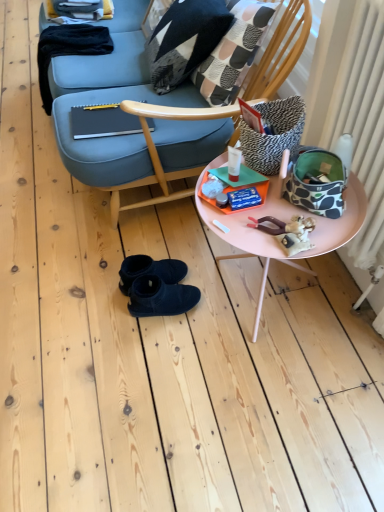
Question: Can you confirm if zebra-patterned fabric pillow at upper right, the 1th pillow in the front-to-back sequence, is wider than patchwork fabric throw pillow at upper center?

Choices:
 (A) no
 (B) yes

Answer: (A)

Question: Is zebra-patterned fabric pillow at upper right, arranged as the second pillow when viewed from the top, positioned with its back to patchwork fabric throw pillow at upper center?

Choices:
 (A) no
 (B) yes

Answer: (A)

Question: From a real-world perspective, is zebra-patterned fabric pillow at upper right, the 1th pillow positioned from the bottom, below patchwork fabric throw pillow at upper center?

Choices:
 (A) no
 (B) yes

Answer: (A)

Question: Is zebra-patterned fabric pillow at upper right, arranged as the second pillow when viewed from the top, positioned behind patchwork fabric throw pillow at upper center?

Choices:
 (A) no
 (B) yes

Answer: (A)

Question: Does zebra-patterned fabric pillow at upper right, positioned as the 1th pillow in right-to-left order, have a lesser height compared to patchwork fabric throw pillow at upper center?

Choices:
 (A) yes
 (B) no

Answer: (A)

Question: Based on their sizes in the image, would you say zebra-patterned fabric pillow at upper right, positioned as the 1th pillow in right-to-left order, is bigger or smaller than black suede boots at center?

Choices:
 (A) big
 (B) small

Answer: (A)

Question: Considering the positions of zebra-patterned fabric pillow at upper right, positioned as the 1th pillow in right-to-left order, and black suede boots at center in the image, is zebra-patterned fabric pillow at upper right, positioned as the 1th pillow in right-to-left order, wider or thinner than black suede boots at center?

Choices:
 (A) thin
 (B) wide

Answer: (A)

Question: Is zebra-patterned fabric pillow at upper right, marked as the second pillow in a back-to-front arrangement, in front of or behind black suede boots at center in the image?

Choices:
 (A) behind
 (B) front

Answer: (B)

Question: Is zebra-patterned fabric pillow at upper right, positioned as the second pillow in left-to-right order, taller or shorter than black suede boots at center?

Choices:
 (A) short
 (B) tall

Answer: (B)

Question: Which is correct: pink plastic table at center is inside black-and-white geometric-patterned pillow at upper center, positioned as the 2th pillow in bottom-to-top order, or outside of it?

Choices:
 (A) inside
 (B) outside

Answer: (B)

Question: Considering the positions of pink plastic table at center and black-and-white geometric-patterned pillow at upper center, the 2th pillow viewed from the right, in the image, is pink plastic table at center bigger or smaller than black-and-white geometric-patterned pillow at upper center, the 2th pillow viewed from the right,?

Choices:
 (A) small
 (B) big

Answer: (B)

Question: From a real-world perspective, is pink plastic table at center physically located above or below black-and-white geometric-patterned pillow at upper center, which ranks as the second pillow in front-to-back order?

Choices:
 (A) below
 (B) above

Answer: (A)

Question: Would you say pink plastic table at center is to the left or to the right of black-and-white geometric-patterned pillow at upper center, the 1th pillow positioned from the top, in the picture?

Choices:
 (A) right
 (B) left

Answer: (A)

Question: Is white textured radiator at right bigger or smaller than black suede boots at center?

Choices:
 (A) small
 (B) big

Answer: (B)

Question: Does point (369, 59) appear closer or farther from the camera than point (132, 257)?

Choices:
 (A) closer
 (B) farther

Answer: (A)